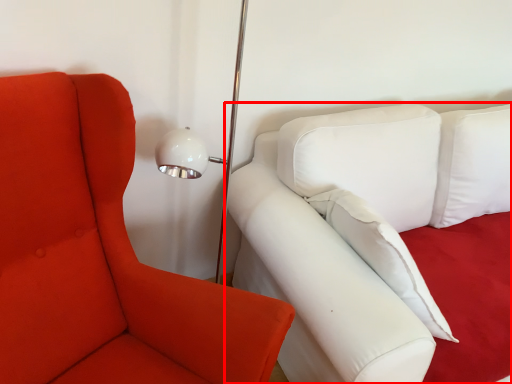
Question: Where is studio couch (annotated by the red box) located in relation to chair in the image?

Choices:
 (A) right
 (B) left

Answer: (A)